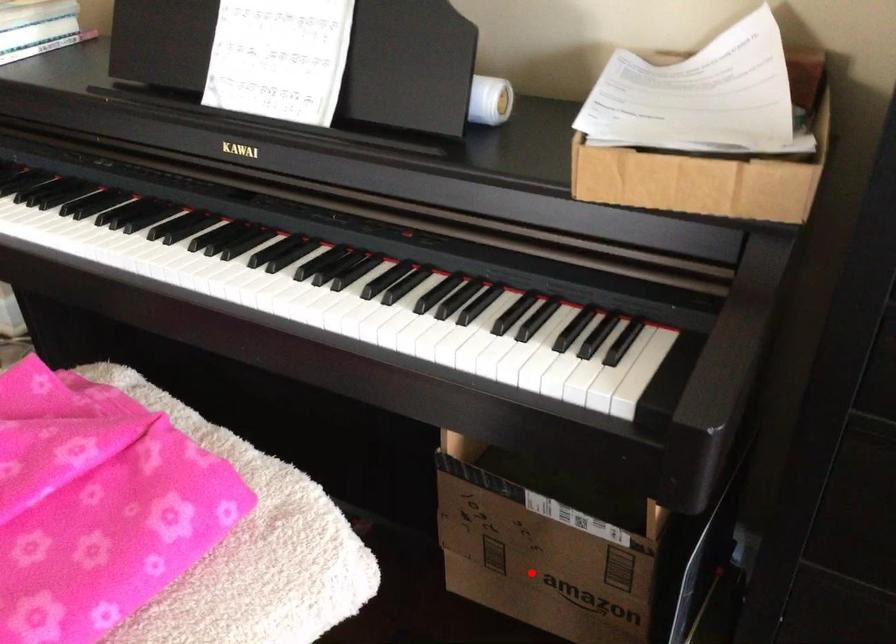
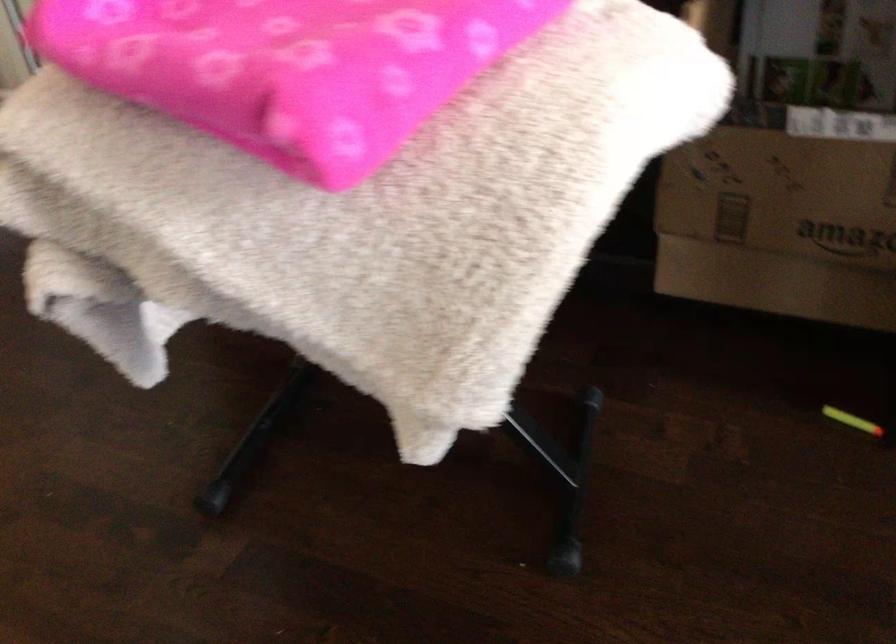
Question: I am providing you with two images of the same scene from different viewpoints. Given a red point in image1, look at the same physical point in image2. Is it:

Choices:
 (A) Closer to the viewpoint
 (B) Farther from the viewpoint

Answer: (A)